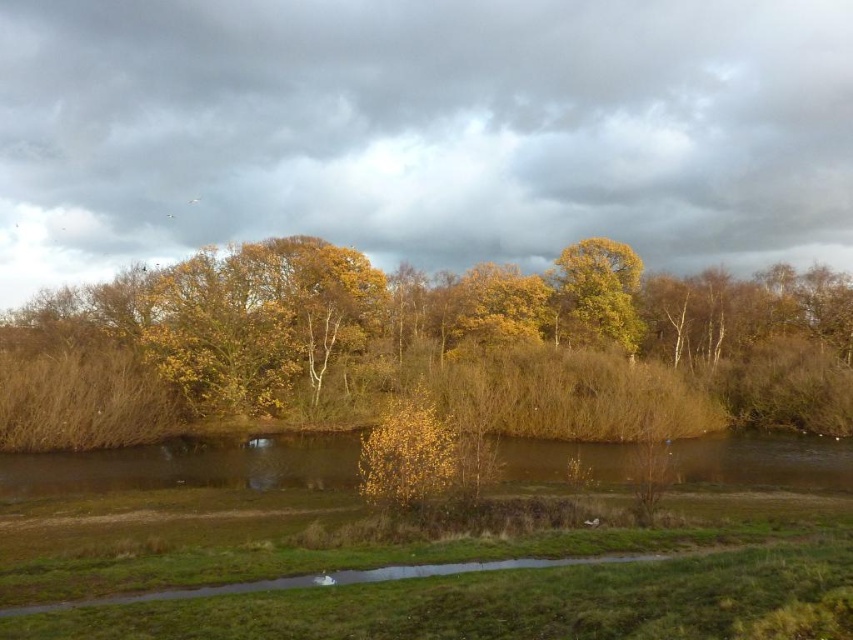
You are standing at the point with coordinates point [119,276] and want to walk towards the point [589,305]. Based on the scene description, is the point you are currently standing at closer to the water or the trees?

The point [119,276] is in front of point [589,305], so it is closer to the water in the foreground.

You are planning to place a small garden bench between the two yellow leafy trees in the scene. Which tree, the yellow leafy tree at center or the yellow leafy tree at upper center, should you position the bench closer to if you want it to be under the wider tree?

You should position the bench closer to the yellow leafy tree at center because its width is larger than the yellow leafy tree at upper center.

You are standing in the serene landscape and want to walk to the yellow leafy tree at center. If your walking speed is 3 feet per second, how long will it take you to reach the tree?

The distance between you and the yellow leafy tree at center is 76.02 feet. At a walking speed of 3 feet per second, it would take approximately 25.34 seconds to reach the tree.